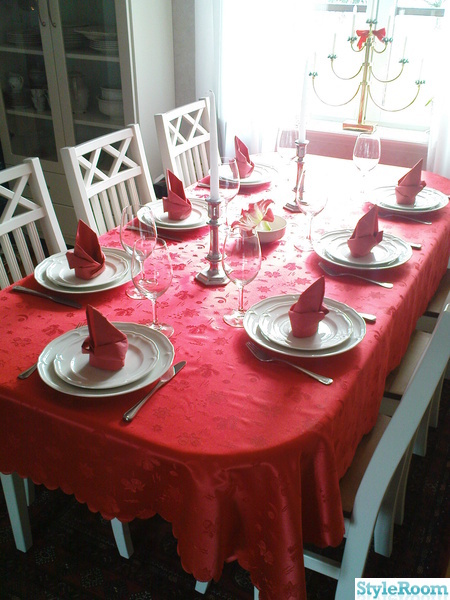
Locate an element on the screen. The image size is (450, 600). goblet or wine glass is located at coordinates (145, 269), (138, 226), (225, 182), (370, 154), (315, 206), (237, 261), (283, 141).